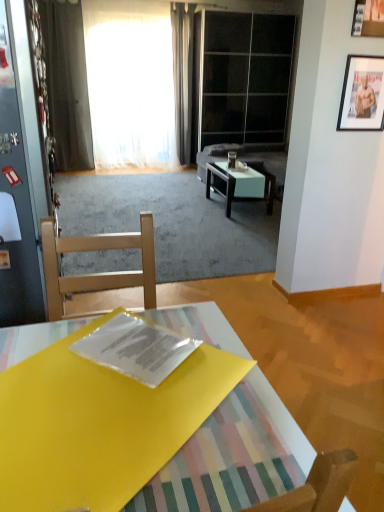
Question: Does suede gray couch at center have a greater height compared to transparent glass door at upper center, the 1th glass door in the right-to-left sequence?

Choices:
 (A) no
 (B) yes

Answer: (A)

Question: Can you confirm if suede gray couch at center is bigger than transparent glass door at upper center, the 1th glass door in the right-to-left sequence?

Choices:
 (A) yes
 (B) no

Answer: (B)

Question: Is the position of suede gray couch at center less distant than that of transparent glass door at upper center, which is the first glass door in back-to-front order?

Choices:
 (A) no
 (B) yes

Answer: (B)

Question: From the image's perspective, is suede gray couch at center above transparent glass door at upper center, the 1th glass door in the right-to-left sequence?

Choices:
 (A) no
 (B) yes

Answer: (A)

Question: Is suede gray couch at center placed right next to transparent glass door at upper center, placed as the second glass door when sorted from bottom to top?

Choices:
 (A) no
 (B) yes

Answer: (A)

Question: Is white sheer curtain at upper center, which appears as the 1th curtain when viewed from the left, wider or thinner than transparent glass door at upper center, marked as the 1th glass door in a top-to-bottom arrangement?

Choices:
 (A) thin
 (B) wide

Answer: (A)

Question: Is white sheer curtain at upper center, marked as the 2th curtain in a right-to-left arrangement, in front of or behind transparent glass door at upper center, the 2th glass door positioned from the front, in the image?

Choices:
 (A) behind
 (B) front

Answer: (B)

Question: Considering the positions of point (86, 15) and point (205, 133), is point (86, 15) closer or farther from the camera than point (205, 133)?

Choices:
 (A) farther
 (B) closer

Answer: (B)

Question: From a real-world perspective, is white sheer curtain at upper center, which appears as the 1th curtain when viewed from the left, positioned above or below transparent glass door at upper center, which is the first glass door in back-to-front order?

Choices:
 (A) above
 (B) below

Answer: (B)

Question: Do you think transparent glass door at upper center, which is the first glass door in back-to-front order, is within metallic silver picture frame at upper right, placed as the second picture frame when sorted from front to back, or outside of it?

Choices:
 (A) outside
 (B) inside

Answer: (A)

Question: Considering the positions of transparent glass door at upper center, acting as the 2th glass door starting from the left, and metallic silver picture frame at upper right, which ranks as the 2th picture frame in top-to-bottom order, in the image, is transparent glass door at upper center, acting as the 2th glass door starting from the left, taller or shorter than metallic silver picture frame at upper right, which ranks as the 2th picture frame in top-to-bottom order,?

Choices:
 (A) tall
 (B) short

Answer: (A)

Question: Is point (203, 65) closer or farther from the camera than point (360, 92)?

Choices:
 (A) closer
 (B) farther

Answer: (B)

Question: From the image's perspective, relative to metallic silver picture frame at upper right, positioned as the first picture frame in bottom-to-top order, is transparent glass door at upper center, the 2th glass door positioned from the front, above or below?

Choices:
 (A) below
 (B) above

Answer: (B)

Question: Considering the relative positions of wooden picture frame at upper right, which ranks as the first picture frame in front-to-back order, and metallic glass door at left, which ranks as the first glass door in front-to-back order, in the image provided, is wooden picture frame at upper right, which ranks as the first picture frame in front-to-back order, to the left or to the right of metallic glass door at left, which ranks as the first glass door in front-to-back order,?

Choices:
 (A) right
 (B) left

Answer: (A)

Question: Considering their positions, is wooden picture frame at upper right, which appears as the second picture frame when ordered from the bottom, located in front of or behind metallic glass door at left, which is counted as the second glass door, starting from the top?

Choices:
 (A) front
 (B) behind

Answer: (B)